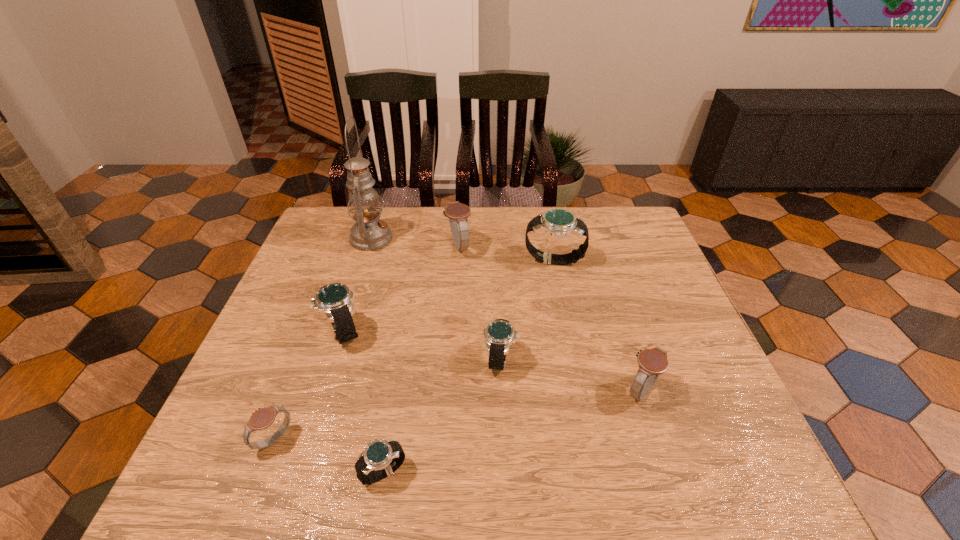
In order to click on the tallest object in this screenshot , I will do `click(369, 233)`.

I want to click on gray oil lamp, so click(369, 233).

This screenshot has height=540, width=960. I want to click on the biggest silver watch, so click(558, 222).

Identify the location of the rightmost silver watch. Image resolution: width=960 pixels, height=540 pixels. (558, 222).

I want to click on the biggest gray watch, so click(x=458, y=213).

Locate an element on the screen. This screenshot has width=960, height=540. the second gray watch from right to left is located at coordinates (458, 213).

Where is `the third smallest silver watch`? The height and width of the screenshot is (540, 960). the third smallest silver watch is located at coordinates (335, 300).

Locate an element on the screen. The width and height of the screenshot is (960, 540). the second farthest gray watch is located at coordinates (652, 362).

I want to click on the second biggest gray watch, so click(652, 362).

At what (x,y) coordinates should I click in order to perform the action: click on the fifth watch from left to right. Please return your answer as a coordinate pair (x, y). The height and width of the screenshot is (540, 960). Looking at the image, I should click on 499,334.